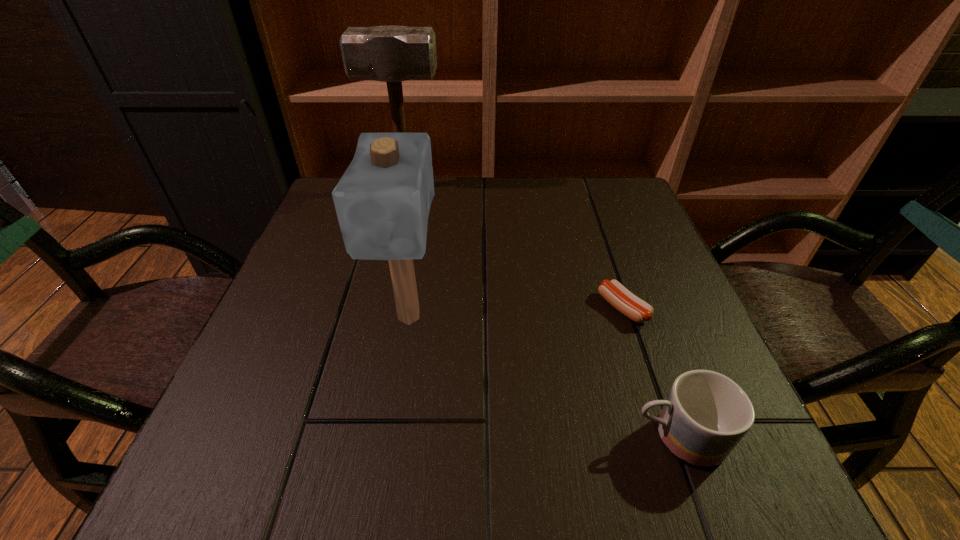
You are a GUI agent. You are given a task and a screenshot of the screen. Output one action in this format:
    pyautogui.click(x=<x>, y=<y>)
    Task: Click on the vacant space at the left edge
    
    Given the screenshot: What is the action you would take?
    pyautogui.click(x=299, y=275)

The height and width of the screenshot is (540, 960). I want to click on free space at the right edge of the desktop, so click(682, 302).

At what (x,y) coordinates should I click in order to perform the action: click on vacant position at the far right corner of the desktop. Please return your answer as a coordinate pair (x, y). The height and width of the screenshot is (540, 960). Looking at the image, I should click on (585, 215).

What are the coordinates of `free area in between the sausage and the third tallest object` in the screenshot? It's located at (650, 373).

You are a GUI agent. You are given a task and a screenshot of the screen. Output one action in this format:
    pyautogui.click(x=<x>, y=<y>)
    Task: Click on the free area in between the farther mallet and the second shortest object
    
    Given the screenshot: What is the action you would take?
    pyautogui.click(x=542, y=312)

Find the location of a particular element. vacant space that's between the nearer mallet and the second shortest object is located at coordinates (543, 377).

I want to click on blank region between the mug and the farther mallet, so click(x=542, y=312).

Find the location of a particular element. free area in between the shortest object and the nearest object is located at coordinates (650, 373).

Find the location of a particular element. vacant area between the nearer mallet and the second shortest object is located at coordinates (543, 377).

The width and height of the screenshot is (960, 540). I want to click on vacant area that lies between the shortest object and the nearest object, so click(650, 373).